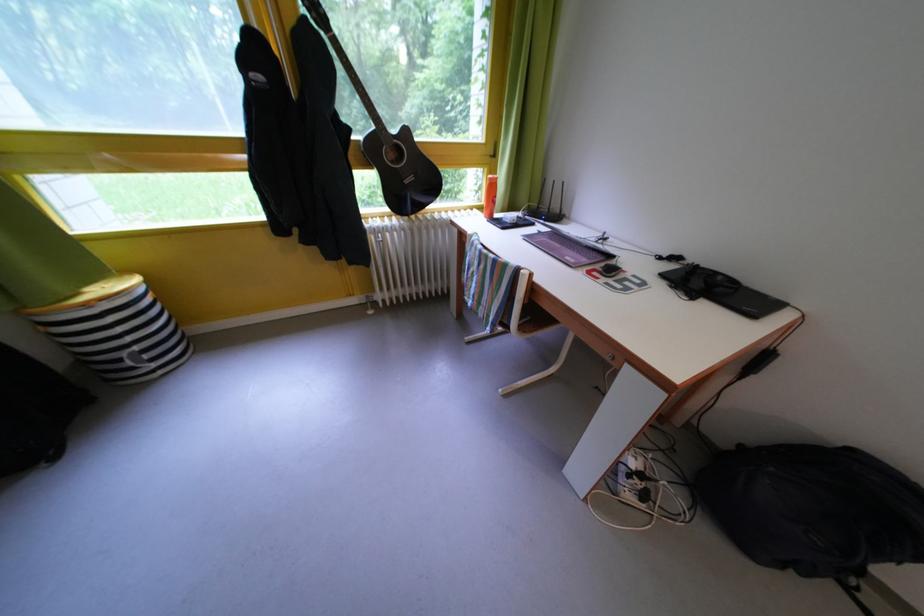
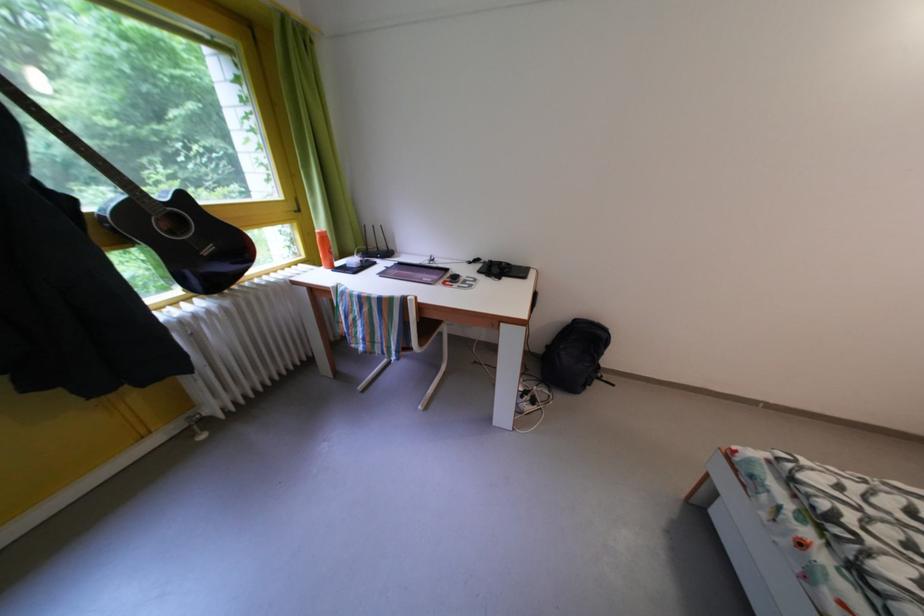
The point at (x=385, y=236) is marked in the first image. Where is the corresponding point in the second image?

(190, 328)